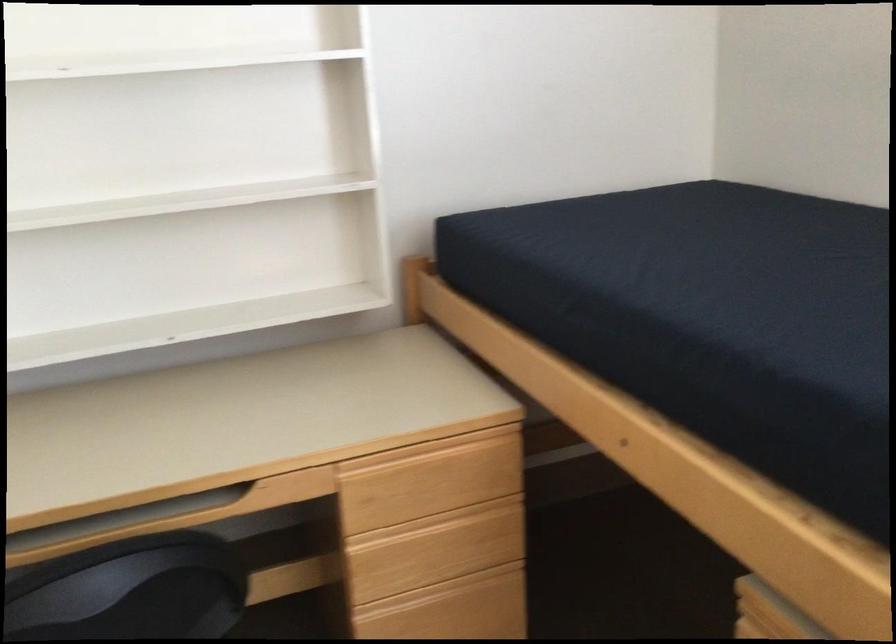
The images are taken continuously from a first-person perspective. In which direction is your viewpoint rotating?

The camera's rotation is toward right-down.